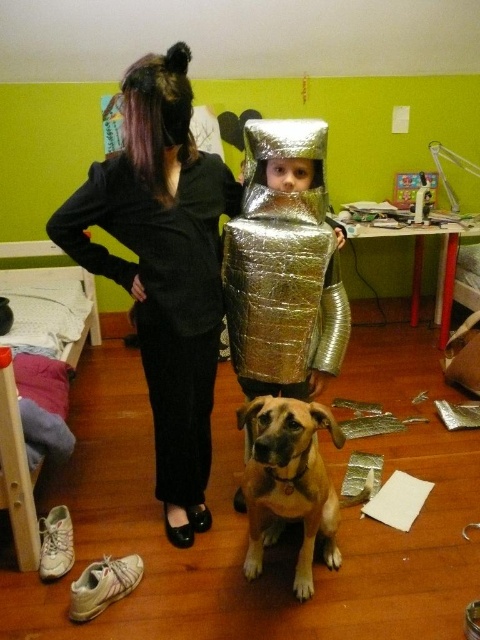
You are standing in a child bedroom with a vibrant green wall. You see two points marked in the scene. The first point is at coordinate point (85, 180) and the second is at coordinate point (324, 529). Which point is closer to you?

Point (85, 180) is closer to you because it is further to the viewer than point (324, 529).